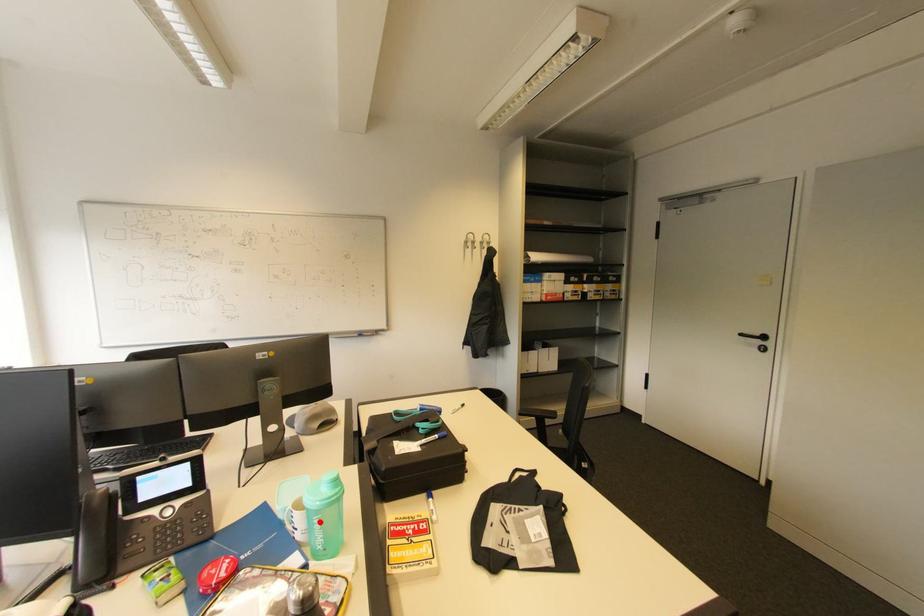
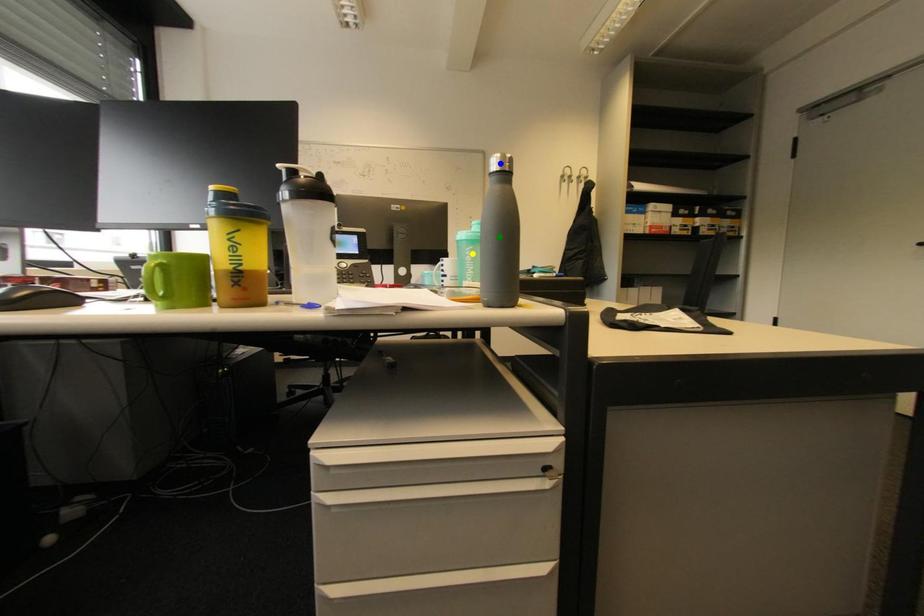
Question: I am providing you with two images of the same scene from different viewpoints. A red point is marked on the first image. You are given multiple points on the second image. Which point in image 2 represents the same 3d spot as the red point in image 1?

Choices:
 (A) blue point
 (B) yellow point
 (C) green point

Answer: (B)